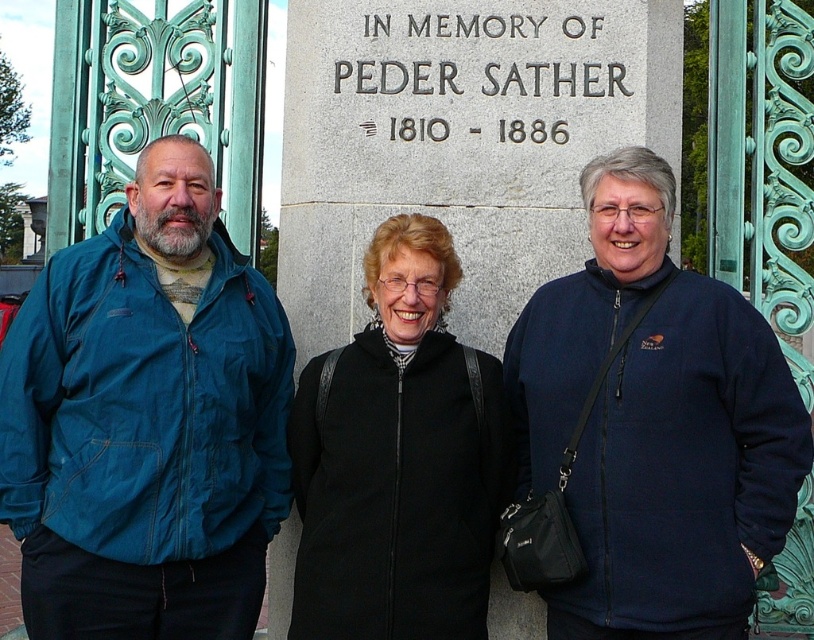
Between blue fabric jacket at left and black matte jacket at center, which one is positioned higher?

blue fabric jacket at left is higher up.

Who is more forward, (191, 308) or (447, 538)?

Point (447, 538) is in front.

Locate an element on the screen. blue fabric jacket at left is located at coordinates (147, 420).

The height and width of the screenshot is (640, 814). What are the coordinates of `navy fleece jacket at center` in the screenshot? It's located at (655, 422).

Is point (696, 497) closer to camera compared to point (440, 547)?

Yes, point (696, 497) is closer to viewer.

You are a GUI agent. You are given a task and a screenshot of the screen. Output one action in this format:
    pyautogui.click(x=<x>, y=<y>)
    Task: Click on the navy fleece jacket at center
    
    Given the screenshot: What is the action you would take?
    pyautogui.click(x=655, y=422)

From the picture: Who is more forward, (130, 262) or (689, 448)?

Positioned in front is point (689, 448).

Which is more to the right, blue fabric jacket at left or navy fleece jacket at center?

navy fleece jacket at center

Who is more distant from viewer, (38,321) or (679,621)?

Point (38,321)

This screenshot has width=814, height=640. In order to click on blue fabric jacket at left in this screenshot , I will do `click(147, 420)`.